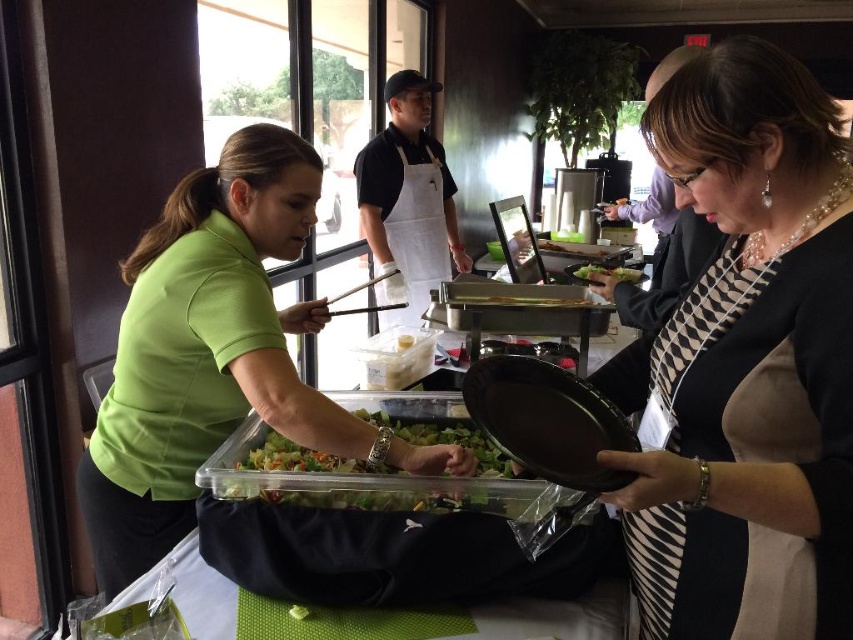
Consider the image. You are a customer at the buffet and want to choose between the translucent plastic salad at center and the green leafy salad at center. Which one is on the left side?

The translucent plastic salad at center is positioned to the left of the green leafy salad at center.

You are a photographer positioned at the entrance of the restaurant. You need to capture a photo of the black and white striped dress at center and the translucent plastic salad at center. Which object is narrower in width when viewed from your position?

The black and white striped dress at center is narrower in width than the translucent plastic salad at center.